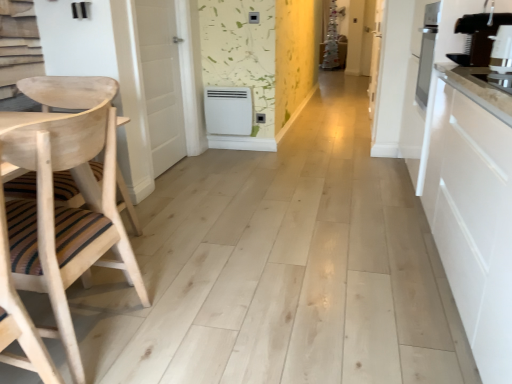
Question: Does white wood door at center, the second door positioned from the left, come behind black plastic coffee machine at right?

Choices:
 (A) no
 (B) yes

Answer: (B)

Question: Is white wood door at center, the second door positioned from the left, looking in the opposite direction of black plastic coffee machine at right?

Choices:
 (A) yes
 (B) no

Answer: (B)

Question: Does white wood door at center, the second door positioned from the left, have a lesser height compared to black plastic coffee machine at right?

Choices:
 (A) yes
 (B) no

Answer: (B)

Question: Would you consider white wood door at center, which is the first door in back-to-front order, to be distant from black plastic coffee machine at right?

Choices:
 (A) yes
 (B) no

Answer: (A)

Question: Considering the relative sizes of white wood door at center, the second door positioned from the left, and black plastic coffee machine at right in the image provided, is white wood door at center, the second door positioned from the left, bigger than black plastic coffee machine at right?

Choices:
 (A) no
 (B) yes

Answer: (B)

Question: Considering the relative positions of natural wood chair at left and white smooth door at left, which appears as the first door when viewed from the left, in the image provided, is natural wood chair at left to the left or to the right of white smooth door at left, which appears as the first door when viewed from the left,?

Choices:
 (A) right
 (B) left

Answer: (B)

Question: Considering the positions of natural wood chair at left and white smooth door at left, which is the 2th door in right-to-left order, in the image, is natural wood chair at left bigger or smaller than white smooth door at left, which is the 2th door in right-to-left order,?

Choices:
 (A) big
 (B) small

Answer: (A)

Question: Looking at their shapes, would you say natural wood chair at left is wider or thinner than white smooth door at left, the 2th door viewed from the back?

Choices:
 (A) wide
 (B) thin

Answer: (A)

Question: Does point (55, 311) appear closer or farther from the camera than point (137, 34)?

Choices:
 (A) farther
 (B) closer

Answer: (B)

Question: From the image's perspective, is black plastic coffee machine at right above or below white smooth door at left, the 2th door viewed from the back?

Choices:
 (A) below
 (B) above

Answer: (A)

Question: From a real-world perspective, relative to white smooth door at left, which is the 2th door in right-to-left order, is black plastic coffee machine at right vertically above or below?

Choices:
 (A) above
 (B) below

Answer: (A)

Question: Looking at their shapes, would you say black plastic coffee machine at right is wider or thinner than white smooth door at left, the 2th door viewed from the back?

Choices:
 (A) thin
 (B) wide

Answer: (B)

Question: Does point (485, 21) appear closer or farther from the camera than point (156, 64)?

Choices:
 (A) farther
 (B) closer

Answer: (B)

Question: Is point (370, 86) closer or farther from the camera than point (141, 44)?

Choices:
 (A) farther
 (B) closer

Answer: (A)

Question: Is white wood door at center, which is the first door in back-to-front order, taller or shorter than white smooth door at left, which appears as the first door when viewed from the left?

Choices:
 (A) short
 (B) tall

Answer: (B)